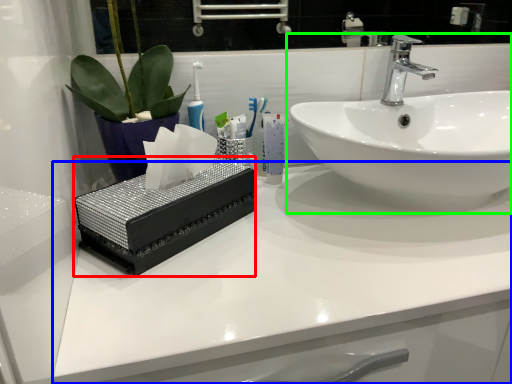
Question: Which object is positioned closest to box (highlighted by a red box)? Select from counter top (highlighted by a blue box) and sink (highlighted by a green box).

Choices:
 (A) counter top
 (B) sink

Answer: (A)